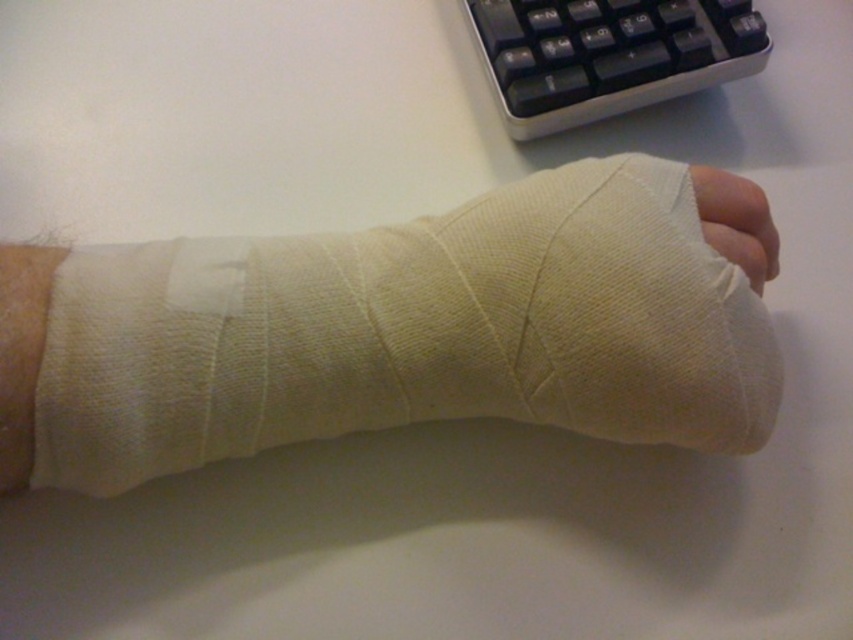
You are a healthcare professional checking the bandage on a patient. You need to reach for the keyboard to document the patient status. Which object is closer to you, the black plastic keyboard at upper right or the white fabric bandage at center?

The black plastic keyboard at upper right is closer to you than the white fabric bandage at center, so you should reach for the black plastic keyboard at upper right first.

Looking at this image, you are a nurse checking the bandage on a patient. You notice the white cloth bandage at center and the black plastic keyboard at upper right. Which object is positioned higher up in the image?

The white cloth bandage at center is positioned higher up in the image than the black plastic keyboard at upper right because it is much taller.

You are a nurse checking the bandage on a patient. You need to disinfect the area around the bandage. The disinfectant spray can effectively reach up to 30 inches. Is the point at coordinates point (x=573, y=113) within the disinfectant spray range?

The distance between point (x=573, y=113) and the camera is 32.69 inches, which is beyond the disinfectant spray range of 30 inches. Therefore, the point is out of range.